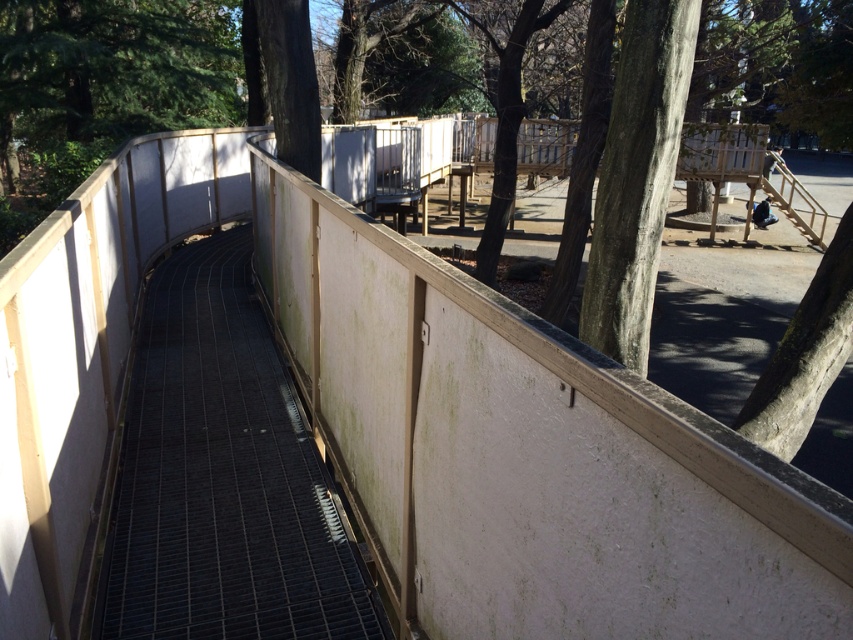
Question: Which of the following is the closest to the observer?

Choices:
 (A) (119, 609)
 (B) (306, 104)

Answer: (A)

Question: Which point is farther from the camera taking this photo?

Choices:
 (A) (647, 26)
 (B) (311, 76)

Answer: (B)

Question: Does gray textured tree trunk at center lie in front of dark brown bark at upper center?

Choices:
 (A) yes
 (B) no

Answer: (A)

Question: Is metal grid walkway at center smaller than dark brown bark at upper center?

Choices:
 (A) no
 (B) yes

Answer: (B)

Question: Which object is positioned farthest from the metal grid walkway at center?

Choices:
 (A) gray textured tree trunk at center
 (B) dark brown bark at upper center

Answer: (B)

Question: Is gray textured tree trunk at center in front of dark brown bark at upper center?

Choices:
 (A) yes
 (B) no

Answer: (A)